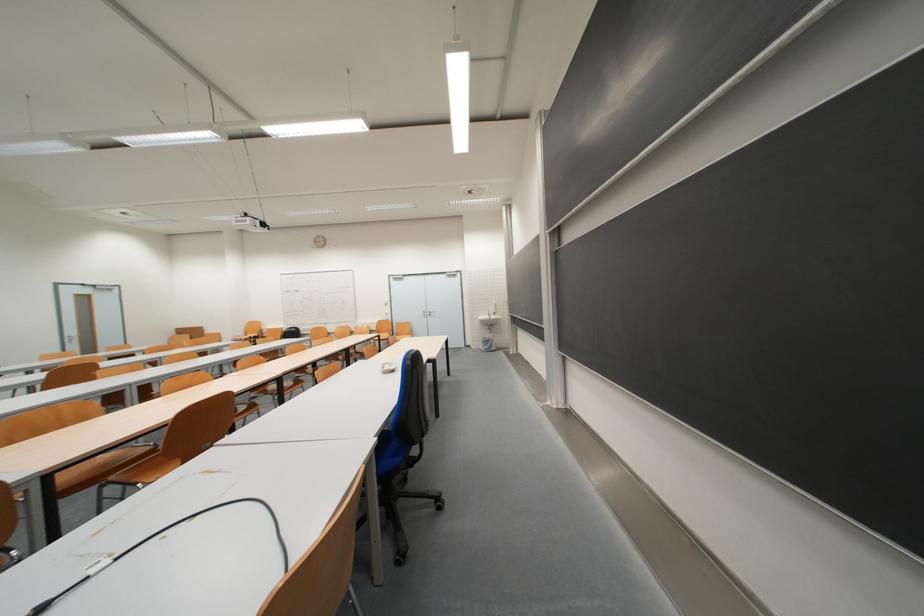
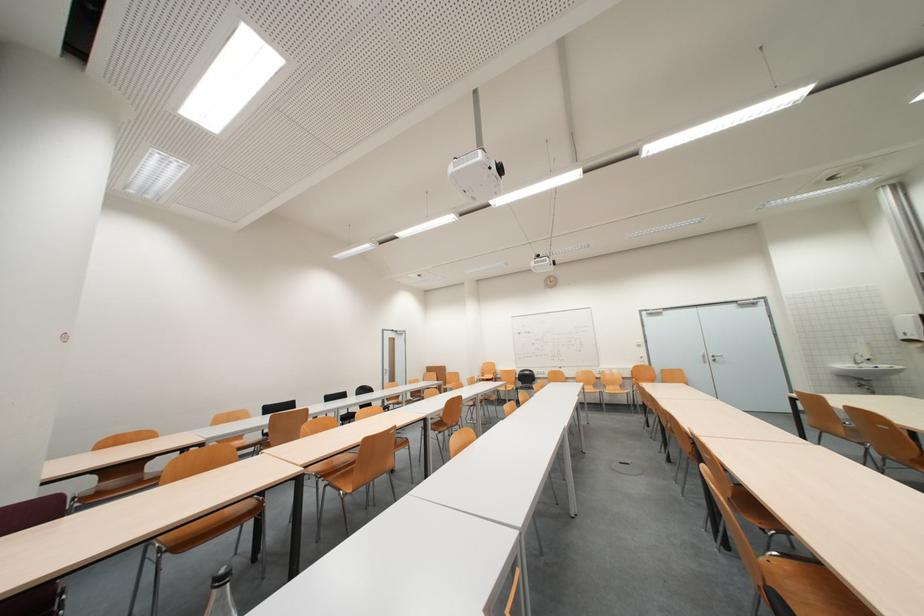
Question: The images are taken continuously from a first-person perspective. In which direction are you moving?

Choices:
 (A) Left
 (B) Right
 (C) Forward
 (D) Backward

Answer: (A)